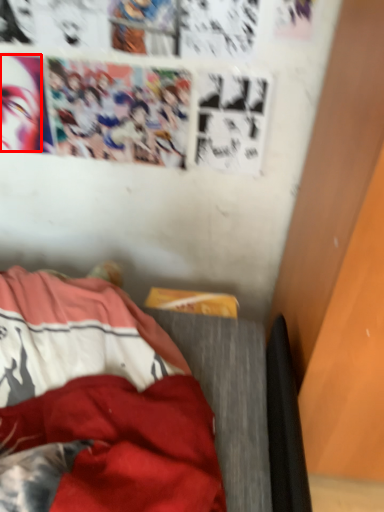
Question: From the image's perspective, where is human face (annotated by the red box) located in relation to furniture in the image?

Choices:
 (A) above
 (B) below

Answer: (A)